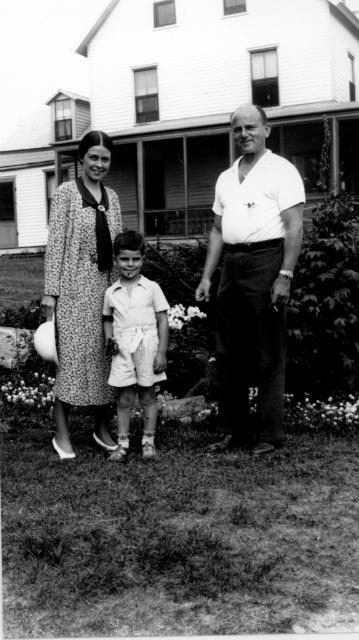
Question: Which of the following is the closest to the observer?

Choices:
 (A) smooth white shirt at center
 (B) dress fabric woman at center

Answer: (B)

Question: Is smooth white shirt at center below dotted fabric dress at center?

Choices:
 (A) no
 (B) yes

Answer: (A)

Question: Which object is farther from the camera taking this photo?

Choices:
 (A) dotted fabric dress at center
 (B) smooth white shirt at center
 (C) smooth white shorts at center

Answer: (A)

Question: Considering the relative positions of dress fabric woman at center and dotted fabric dress at center in the image provided, where is dress fabric woman at center located with respect to dotted fabric dress at center?

Choices:
 (A) above
 (B) below

Answer: (A)

Question: Which point is farther to the camera?

Choices:
 (A) smooth white shorts at center
 (B) dotted fabric dress at center

Answer: (B)

Question: Does dress fabric woman at center appear over smooth white shorts at center?

Choices:
 (A) no
 (B) yes

Answer: (B)